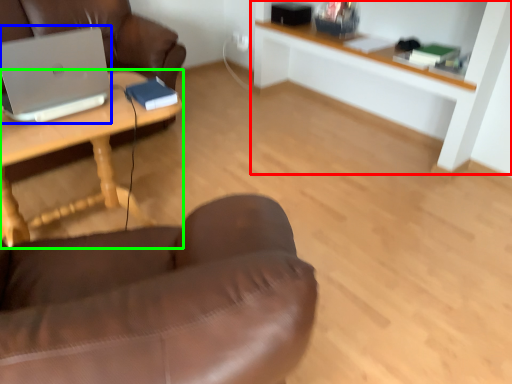
Question: Considering the real-world distances, which object is closest to shelf (highlighted by a red box)? laptop (highlighted by a blue box) or desk (highlighted by a green box).

Choices:
 (A) laptop
 (B) desk

Answer: (B)